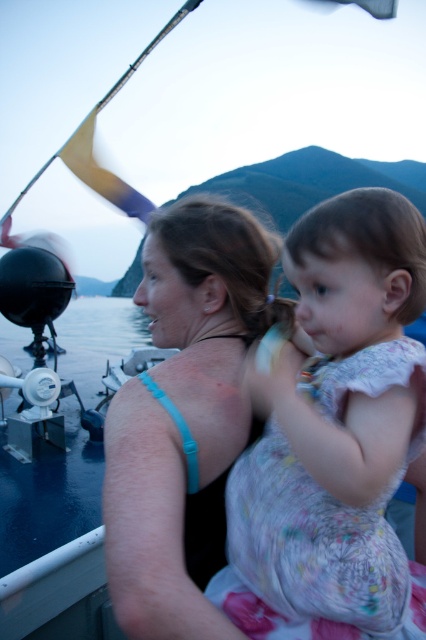
You are a delivery drone that needs to deliver a package to the point at coordinates (293, 234). Your current position is at the woman. Can you safely land at the designated point without hitting the child?

The distance between the woman and the child is 1.38 meters, so yes, the drone can safely land at the designated point (293, 234) as there is enough space between them.

You are a photographer trying to capture the scene from the boat. You want to ensure both the floral dress at center and the blue fabric top at center are visible in your shot. Which item should you focus on first to frame them properly?

The blue fabric top at center is to the left of the floral dress at center, so focusing on the blue fabric top at center first will help frame both items properly in the shot.